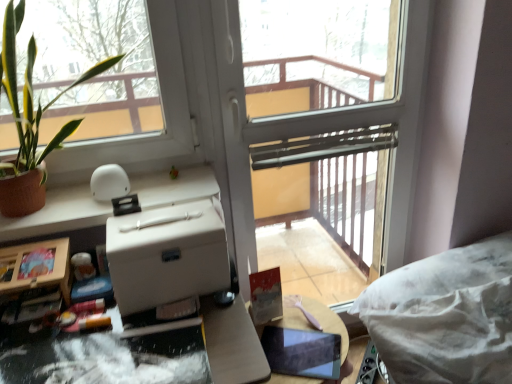
Question: Considering the positions of white matte counter top at upper left and wooden round table at center in the image, is white matte counter top at upper left bigger or smaller than wooden round table at center?

Choices:
 (A) small
 (B) big

Answer: (A)

Question: In terms of width, does white matte counter top at upper left look wider or thinner when compared to wooden round table at center?

Choices:
 (A) thin
 (B) wide

Answer: (A)

Question: Estimate the real-world distances between objects in this image. Which object is farther from the white matte counter top at upper left?

Choices:
 (A) white matte cardboard box at center
 (B) wooden round table at center
 (C) transparent glass screen door at center
 (D) green leafy plant at left

Answer: (B)

Question: Which is farther from the transparent glass screen door at center?

Choices:
 (A) wooden round table at center
 (B) white matte cardboard box at center
 (C) white matte counter top at upper left
 (D) green leafy plant at left

Answer: (D)